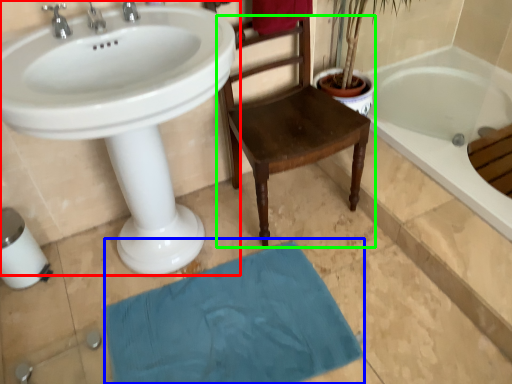
Question: Which object is positioned farthest from sink (highlighted by a red box)? Select from bath mat (highlighted by a blue box) and chair (highlighted by a green box).

Choices:
 (A) bath mat
 (B) chair

Answer: (A)